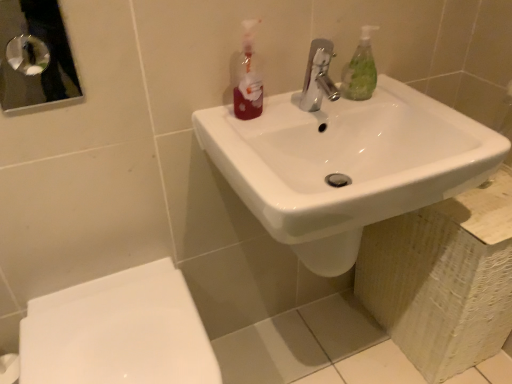
Question: From their relative heights in the image, would you say translucent plastic bottle at upper center is taller or shorter than white glossy toilet at lower left?

Choices:
 (A) tall
 (B) short

Answer: (B)

Question: Considering the positions of translucent plastic bottle at upper center and white glossy toilet at lower left in the image, is translucent plastic bottle at upper center bigger or smaller than white glossy toilet at lower left?

Choices:
 (A) small
 (B) big

Answer: (A)

Question: Based on their relative distances, which object is farther from the polished chrome faucet at center?

Choices:
 (A) white glossy toilet at lower left
 (B) metallic rectangular mirror at upper left
 (C) white glossy sink at center
 (D) green translucent soap dispenser at upper right
 (E) translucent plastic bottle at upper center

Answer: (B)

Question: Which object is the farthest from the translucent plastic bottle at upper center?

Choices:
 (A) polished chrome faucet at center
 (B) white glossy toilet at lower left
 (C) white glossy sink at center
 (D) metallic rectangular mirror at upper left
 (E) green translucent soap dispenser at upper right

Answer: (D)